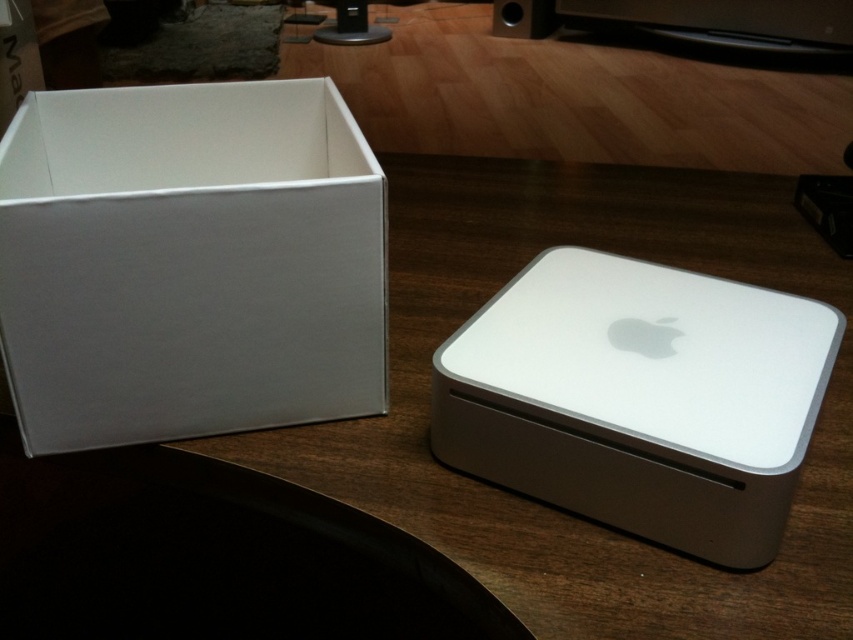
Between point (730, 449) and point (534, 4), which one is positioned behind?

Point (534, 4)

Between white matte apple mac mini at center and matte black speaker at upper center, which one is positioned lower?

Positioned lower is white matte apple mac mini at center.

Image resolution: width=853 pixels, height=640 pixels. I want to click on white matte apple mac mini at center, so click(x=639, y=397).

Looking at this image, can you confirm if white cardboard box at upper left is taller than matte black speaker at upper center?

Yes, white cardboard box at upper left is taller than matte black speaker at upper center.

Does white cardboard box at upper left appear over matte black speaker at upper center?

No, white cardboard box at upper left is not above matte black speaker at upper center.

Which is in front, point (312, 124) or point (509, 24)?

Point (312, 124) is in front.

Identify the location of white cardboard box at upper left. (189, 262).

Is white cardboard box at upper left positioned behind white matte apple mac mini at center?

Yes, it is behind white matte apple mac mini at center.

Who is taller, white cardboard box at upper left or white matte apple mac mini at center?

With more height is white cardboard box at upper left.

Locate an element on the screen. The image size is (853, 640). white cardboard box at upper left is located at coordinates (189, 262).

Where is `white cardboard box at upper left`? white cardboard box at upper left is located at coordinates (189, 262).